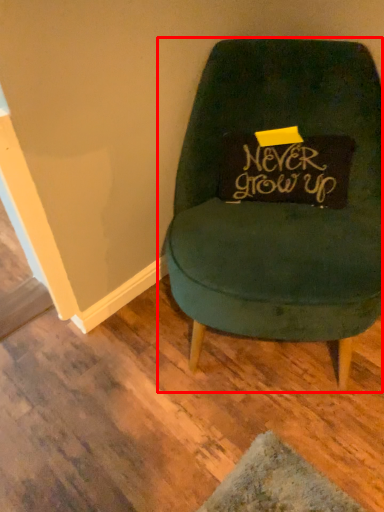
Question: From the image, what is the correct spatial relationship of chair (annotated by the red box) in relation to writing?

Choices:
 (A) right
 (B) left

Answer: (B)